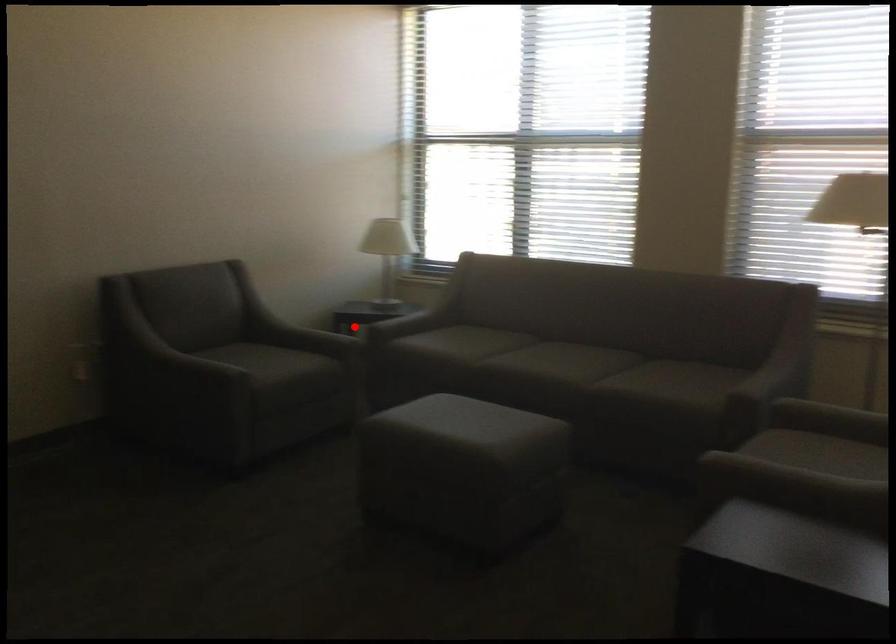
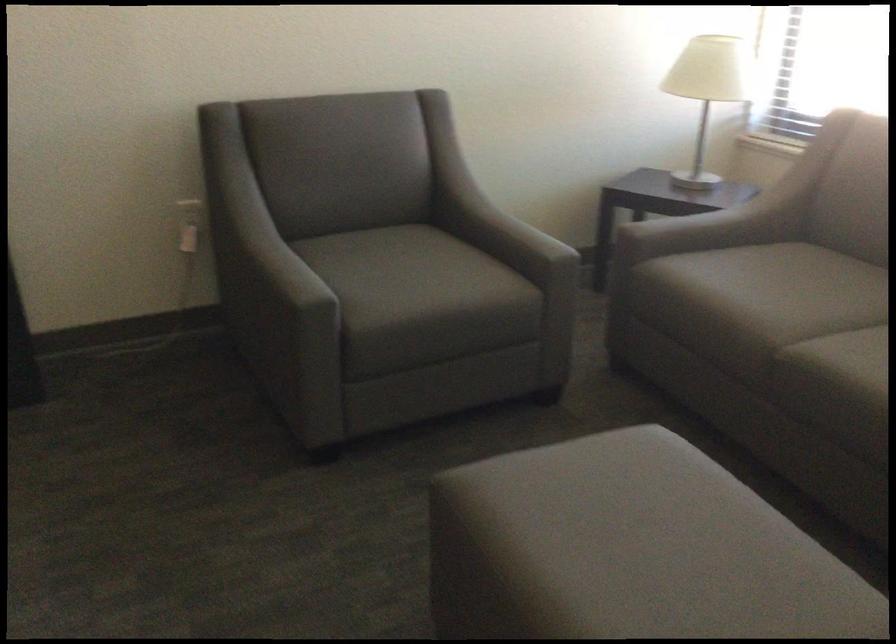
Question: I am providing you with two images of the same scene from different viewpoints. In image1, a red point is highlighted. Considering the same 3D point in image2, which of the following is correct?

Choices:
 (A) It is closer
 (B) It is farther

Answer: (A)